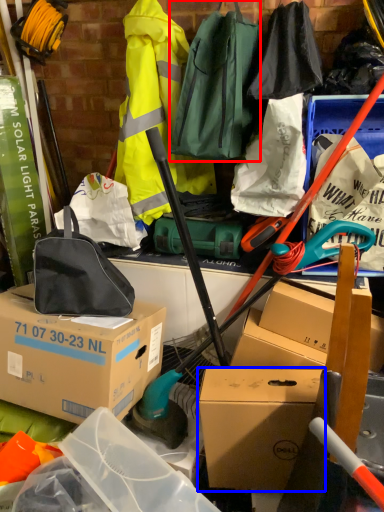
Question: Which object is further to the camera taking this photo, luggage and bags (highlighted by a red box) or box (highlighted by a blue box)?

Choices:
 (A) luggage and bags
 (B) box

Answer: (B)